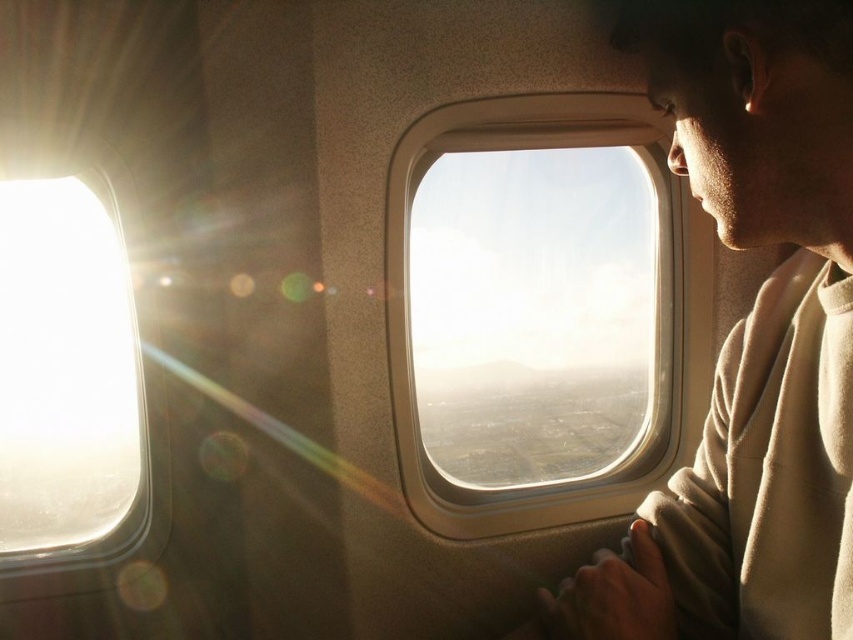
Can you confirm if transparent glass airplane window at left is wider than transparent glass airplane window at center?

No.

Who is more distant from viewer, (136, 506) or (682, 328)?

The point (682, 328) is behind.

Measure the distance between point (38, 230) and camera.

The distance of point (38, 230) from camera is 8.54 feet.

The width and height of the screenshot is (853, 640). Identify the location of transparent glass airplane window at left. (67, 362).

Does beige fleece at upper right have a lesser width compared to transparent glass airplane window at center?

Yes.

Between beige fleece at upper right and transparent glass airplane window at center, which one is positioned lower?

beige fleece at upper right

In order to click on beige fleece at upper right in this screenshot , I will do `click(750, 337)`.

Is beige fleece at upper right to the left of transparent glass airplane window at left from the viewer's perspective?

In fact, beige fleece at upper right is to the right of transparent glass airplane window at left.

Can you confirm if beige fleece at upper right is positioned above transparent glass airplane window at left?

Indeed, beige fleece at upper right is positioned over transparent glass airplane window at left.

The width and height of the screenshot is (853, 640). Identify the location of beige fleece at upper right. (750, 337).